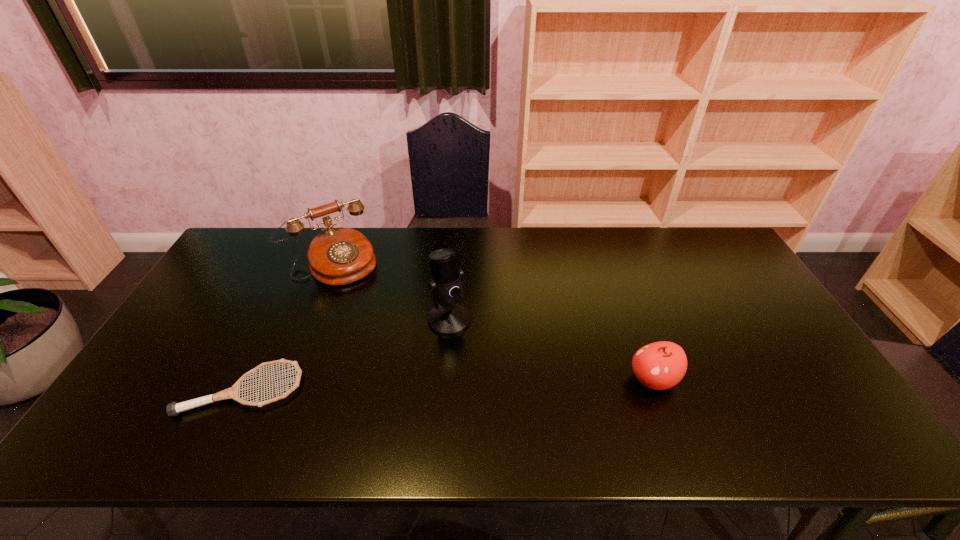
You are a GUI agent. You are given a task and a screenshot of the screen. Output one action in this format:
    pyautogui.click(x=<x>, y=<y>)
    Task: Click on the tennis racket
    The width and height of the screenshot is (960, 540).
    Given the screenshot: What is the action you would take?
    pyautogui.click(x=173, y=409)

You are a GUI agent. You are given a task and a screenshot of the screen. Output one action in this format:
    pyautogui.click(x=<x>, y=<y>)
    Task: Click on the apple
    This screenshot has height=540, width=960.
    Given the screenshot: What is the action you would take?
    pyautogui.click(x=661, y=365)

Identify the location of the rightmost object. (661, 365).

Where is `telephone`? telephone is located at coordinates (337, 256).

At what (x,y) coordinates should I click in order to perform the action: click on the third shortest object. Please return your answer as a coordinate pair (x, y). This screenshot has width=960, height=540. Looking at the image, I should click on (337, 256).

Find the location of a particular element. Image resolution: width=960 pixels, height=540 pixels. the tallest object is located at coordinates (449, 317).

Where is `the second farthest object`? The width and height of the screenshot is (960, 540). the second farthest object is located at coordinates (449, 317).

At what (x,y) coordinates should I click in order to perform the action: click on free space located 0.050m on the back of the tennis racket. Please return your answer as a coordinate pair (x, y). This screenshot has width=960, height=540. Looking at the image, I should click on pyautogui.click(x=262, y=349).

Image resolution: width=960 pixels, height=540 pixels. In order to click on vacant point located 0.300m on the left of the third tallest object in this screenshot , I will do `click(510, 380)`.

Where is `vacant region located on the dial of the telephone`? vacant region located on the dial of the telephone is located at coordinates (396, 347).